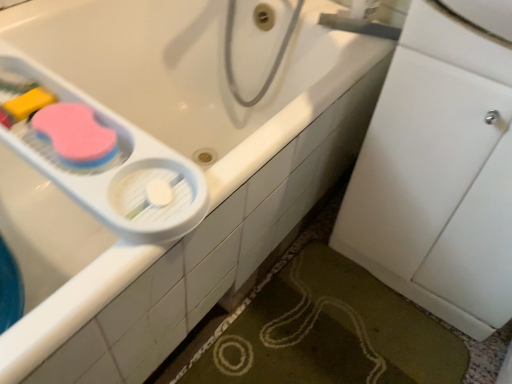
Measure the distance between point (330, 19) and camera.

The distance of point (330, 19) from camera is 1.02 meters.

What do you see at coordinates (114, 168) in the screenshot? This screenshot has width=512, height=384. I see `white plastic container at upper left` at bounding box center [114, 168].

Identify the location of green textured bath mat at lower right. The image size is (512, 384). (328, 332).

What's the angular difference between white plastic faucet at upper right and white plastic container at upper left's facing directions?

24.9 degrees.

Image resolution: width=512 pixels, height=384 pixels. In the image, there is a white plastic faucet at upper right. In order to click on scale below it (from a real-world perspective) in this screenshot , I will do `click(114, 168)`.

Looking at their sizes, would you say white plastic faucet at upper right is wider or thinner than white plastic container at upper left?

Clearly, white plastic faucet at upper right has less width compared to white plastic container at upper left.

Is point (357, 25) closer or farther from the camera than point (114, 197)?

Point (357, 25).

Considering the relative positions of white plastic container at upper left and green textured bath mat at lower right in the image provided, is white plastic container at upper left in front of green textured bath mat at lower right?

Yes, the depth of white plastic container at upper left is less than that of green textured bath mat at lower right.

From the image's perspective, is white plastic container at upper left located above green textured bath mat at lower right?

Indeed, from the image's perspective, white plastic container at upper left is shown above green textured bath mat at lower right.

Could you tell me if white plastic container at upper left is turned towards green textured bath mat at lower right?

No, white plastic container at upper left is not turned towards green textured bath mat at lower right.

Would you say white plastic container at upper left contains green textured bath mat at lower right?

No, green textured bath mat at lower right is located outside of white plastic container at upper left.

Which object is wider, white plastic container at upper left or white plastic faucet at upper right?

white plastic container at upper left is wider.

From a real-world perspective, is white plastic container at upper left positioned above or below white plastic faucet at upper right?

In terms of real-world spatial position, white plastic container at upper left is below white plastic faucet at upper right.

Are white plastic container at upper left and white plastic faucet at upper right located far from each other?

They are positioned close to each other.

In the scene shown: Between white plastic container at upper left and white plastic faucet at upper right, which one appears on the right side from the viewer's perspective?

white plastic faucet at upper right.

The height and width of the screenshot is (384, 512). What are the coordinates of `plumbing fixture above the green textured bath mat at lower right (from the image's perspective)` in the screenshot? It's located at (359, 26).

Consider the image. Considering their positions, is green textured bath mat at lower right located in front of or behind white plastic faucet at upper right?

In the image, green textured bath mat at lower right appears in front of white plastic faucet at upper right.

Which is closer to the camera, (304,278) or (377,25)?

Clearly, point (304,278) is more distant from the camera than point (377,25).

What's the angular difference between green textured bath mat at lower right and white plastic faucet at upper right's facing directions?

There is a 25.6-degree angle between the facing directions of green textured bath mat at lower right and white plastic faucet at upper right.

Is green textured bath mat at lower right aimed at white plastic container at upper left?

No, green textured bath mat at lower right is not oriented towards white plastic container at upper left.

Can you confirm if green textured bath mat at lower right is thinner than white plastic container at upper left?

In fact, green textured bath mat at lower right might be wider than white plastic container at upper left.

Is white plastic container at upper left located within green textured bath mat at lower right?

Actually, white plastic container at upper left is outside green textured bath mat at lower right.

Is green textured bath mat at lower right located within white plastic faucet at upper right?

No.

Is white plastic faucet at upper right bigger than green textured bath mat at lower right?

No, white plastic faucet at upper right is not bigger than green textured bath mat at lower right.

Is point (351, 20) positioned after point (322, 336)?

No.

From a real-world perspective, is white plastic faucet at upper right above or below green textured bath mat at lower right?

white plastic faucet at upper right is situated higher than green textured bath mat at lower right in the real world.

This screenshot has width=512, height=384. What are the coordinates of `scale in front of the white plastic faucet at upper right` in the screenshot? It's located at (114, 168).

Locate an element on the screen. Image resolution: width=512 pixels, height=384 pixels. scale that is on the left side of green textured bath mat at lower right is located at coordinates (114, 168).

From the image, which object appears to be nearer to white plastic faucet at upper right, white plastic container at upper left or green textured bath mat at lower right?

The object closer to white plastic faucet at upper right is white plastic container at upper left.

From the image, which object appears to be nearer to white plastic faucet at upper right, green textured bath mat at lower right or white plastic container at upper left?

Among the two, white plastic container at upper left is located nearer to white plastic faucet at upper right.

Considering their positions, is white plastic faucet at upper right positioned closer to green textured bath mat at lower right than white plastic container at upper left?

white plastic container at upper left is positioned closer to the anchor green textured bath mat at lower right.

Based on their spatial positions, is white plastic container at upper left or white plastic faucet at upper right further from green textured bath mat at lower right?

Among the two, white plastic faucet at upper right is located further to green textured bath mat at lower right.

Based on their spatial positions, is green textured bath mat at lower right or white plastic faucet at upper right closer to white plastic container at upper left?

The object closer to white plastic container at upper left is green textured bath mat at lower right.

Considering their positions, is white plastic faucet at upper right positioned closer to white plastic container at upper left than green textured bath mat at lower right?

The object closer to white plastic container at upper left is green textured bath mat at lower right.

I want to click on scale between white plastic faucet at upper right and green textured bath mat at lower right in the up-down direction, so click(114, 168).